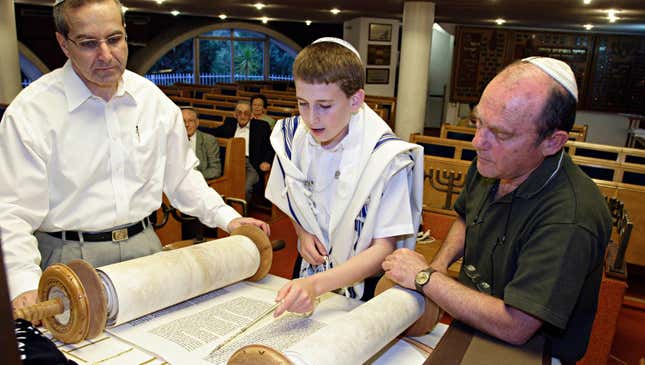
You are a GUI agent. You are given a task and a screenshot of the screen. Output one action in this format:
    pyautogui.click(x=<x>, y=<y>)
    Task: Click on the white robe
    This screenshot has width=645, height=365.
    Given the screenshot: What is the action you would take?
    pyautogui.click(x=349, y=168)